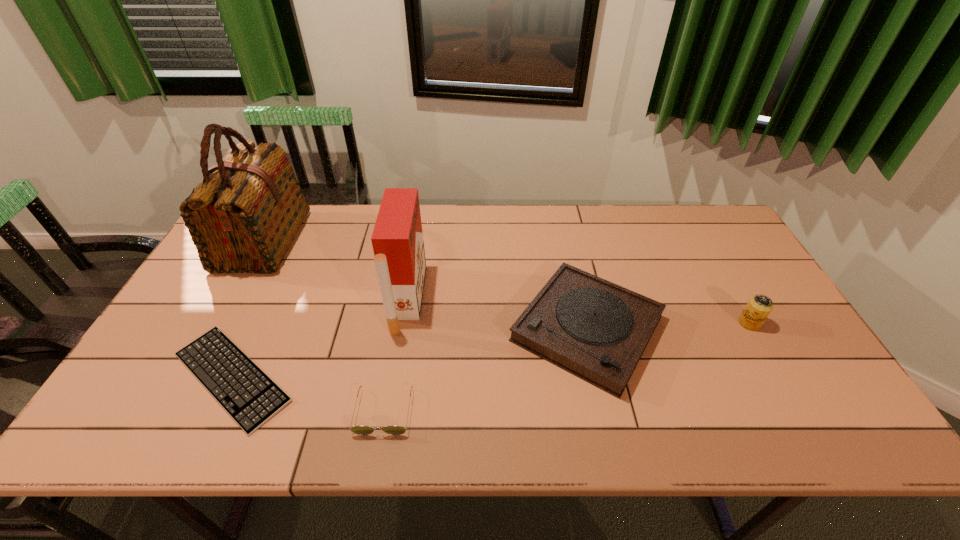
Locate an element on the screen. This screenshot has height=540, width=960. vacant space positioned 0.150m on the back of the third tallest object is located at coordinates pyautogui.click(x=723, y=278).

Where is `free space located 0.300m on the left of the phonograph record`? free space located 0.300m on the left of the phonograph record is located at coordinates (396, 329).

Where is `blank space located 0.200m on the back of the shortest object`? The image size is (960, 540). blank space located 0.200m on the back of the shortest object is located at coordinates (279, 276).

Identify the location of object located at the far edge. Image resolution: width=960 pixels, height=540 pixels. (243, 217).

Find the location of a particular element. Image resolution: width=960 pixels, height=540 pixels. sunglasses present at the near edge is located at coordinates (359, 430).

Find the location of a particular element. computer keyboard that is at the near edge is located at coordinates (250, 397).

Image resolution: width=960 pixels, height=540 pixels. Find the location of `shopping bag located in the left edge section of the desktop`. shopping bag located in the left edge section of the desktop is located at coordinates (243, 217).

Locate an element on the screen. computer keyboard positioned at the left edge is located at coordinates (250, 397).

The image size is (960, 540). I want to click on object at the right edge, so click(x=759, y=307).

Find the location of a particular element. The height and width of the screenshot is (540, 960). object located in the far left corner section of the desktop is located at coordinates (243, 217).